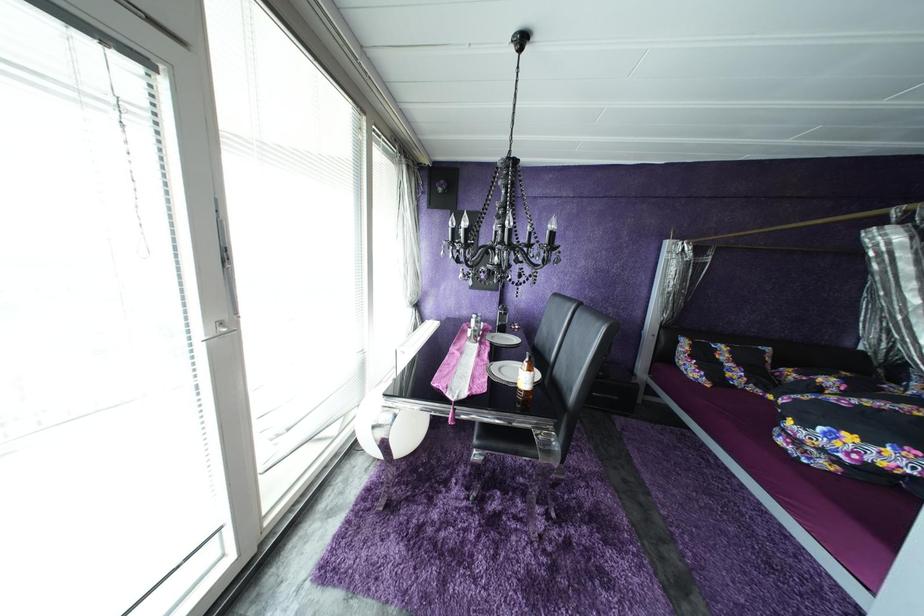
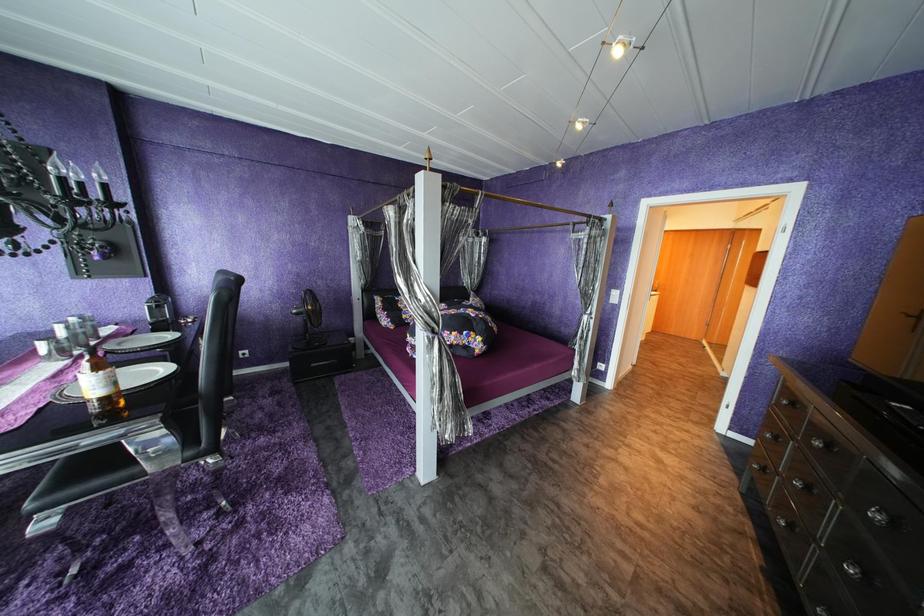
Question: The images are taken continuously from a first-person perspective. In which direction is your viewpoint rotating?

Choices:
 (A) Left
 (B) Right
 (C) Up
 (D) Down

Answer: (B)